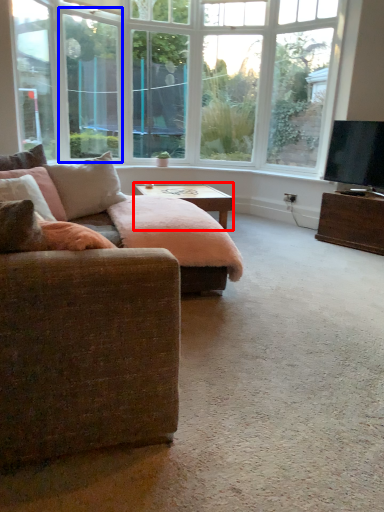
Question: Among these objects, which one is nearest to the camera, table (highlighted by a red box) or window screen (highlighted by a blue box)?

Choices:
 (A) table
 (B) window screen

Answer: (A)